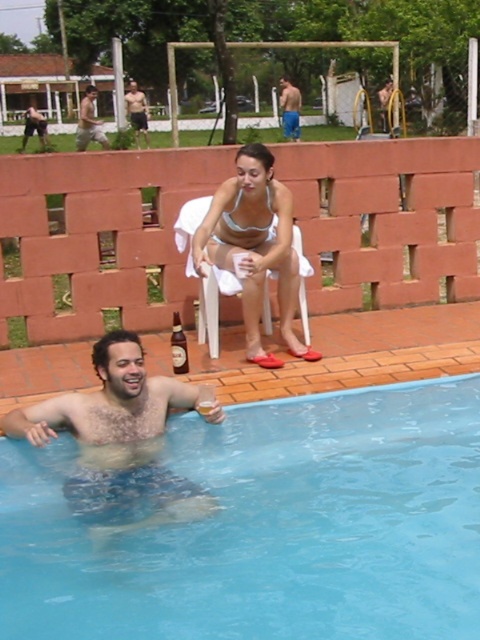
You are a photographer taking a picture of the white bikini at upper center and the white mesh bikini top at upper center. Which one will appear larger in the photo?

The white bikini at upper center will appear larger in the photo because it is closer to the viewer than the white mesh bikini top at upper center.

You are a photographer at the poolside. You need to capture a photo where both the white bikini at upper center and the white mesh bikini top at upper center are clearly visible. However, due to the camera lens limitation, only the taller object can be in focus. Which one should you focus on to ensure clarity?

The white bikini at upper center is taller than the white mesh bikini top at upper center, so you should focus on the white bikini at upper center to ensure clarity.